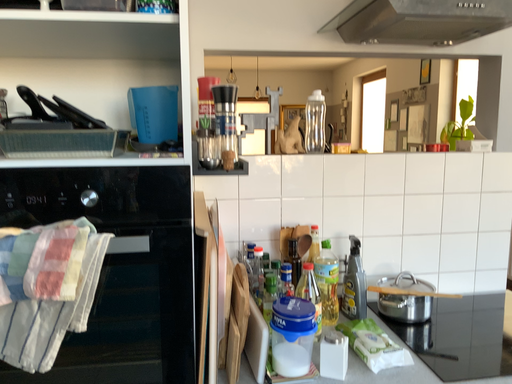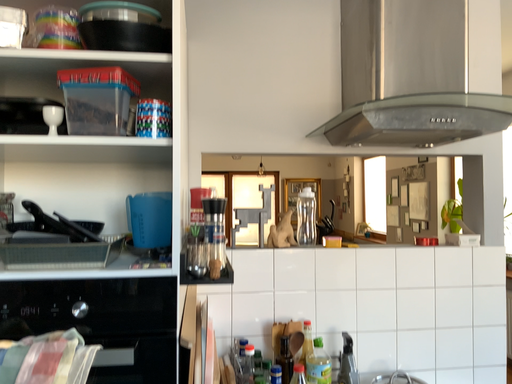
Question: Which way did the camera rotate in the video?

Choices:
 (A) rotated downward
 (B) rotated upward

Answer: (B)